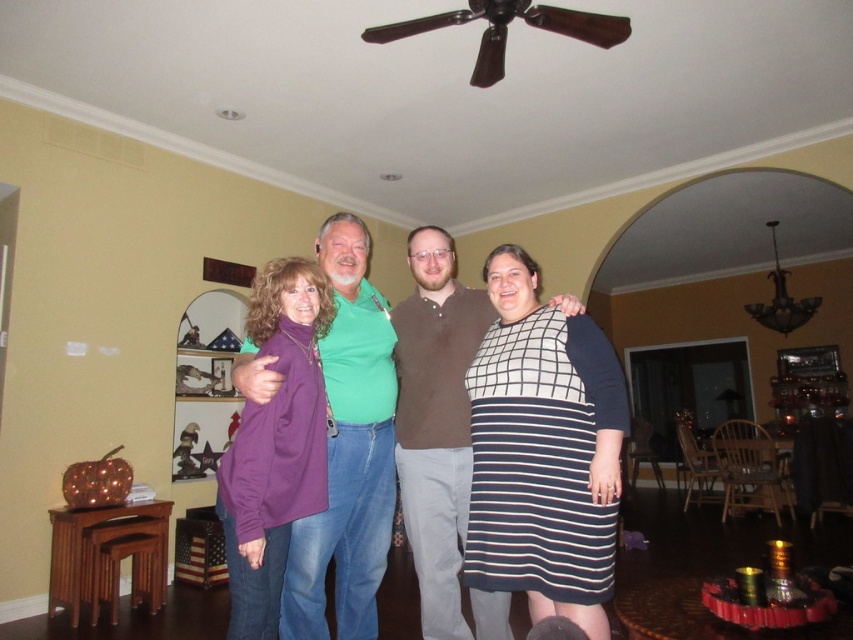
Is striped knit dress at center below purple fleece sweater at center?

No, striped knit dress at center is not below purple fleece sweater at center.

Does striped knit dress at center have a greater height compared to purple fleece sweater at center?

Yes.

Which is behind, point (593, 432) or point (273, 573)?

The point (593, 432) is behind.

The width and height of the screenshot is (853, 640). What are the coordinates of `striped knit dress at center` in the screenshot? It's located at (543, 451).

This screenshot has height=640, width=853. What do you see at coordinates (439, 435) in the screenshot? I see `brown cotton shirt at center` at bounding box center [439, 435].

From the picture: Is brown cotton shirt at center positioned behind purple fleece sweater at center?

That is True.

At what (x,y) coordinates should I click in order to perform the action: click on brown cotton shirt at center. Please return your answer as a coordinate pair (x, y). Looking at the image, I should click on (439, 435).

Does point (323, 253) come closer to viewer compared to point (227, 520)?

No.

Find the location of a particular element. This screenshot has height=640, width=853. matte green shirt at center is located at coordinates (389, 428).